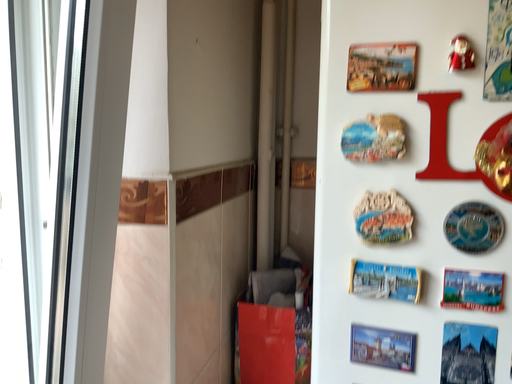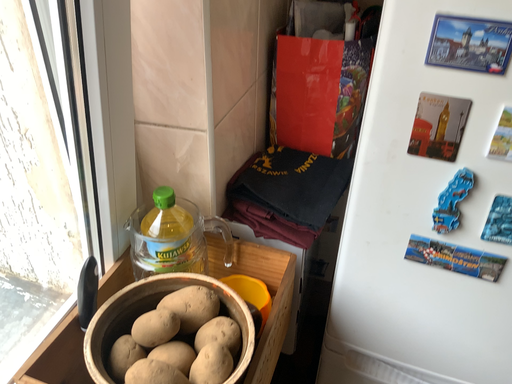
Question: How did the camera likely rotate when shooting the video?

Choices:
 (A) rotated upward
 (B) rotated downward

Answer: (B)